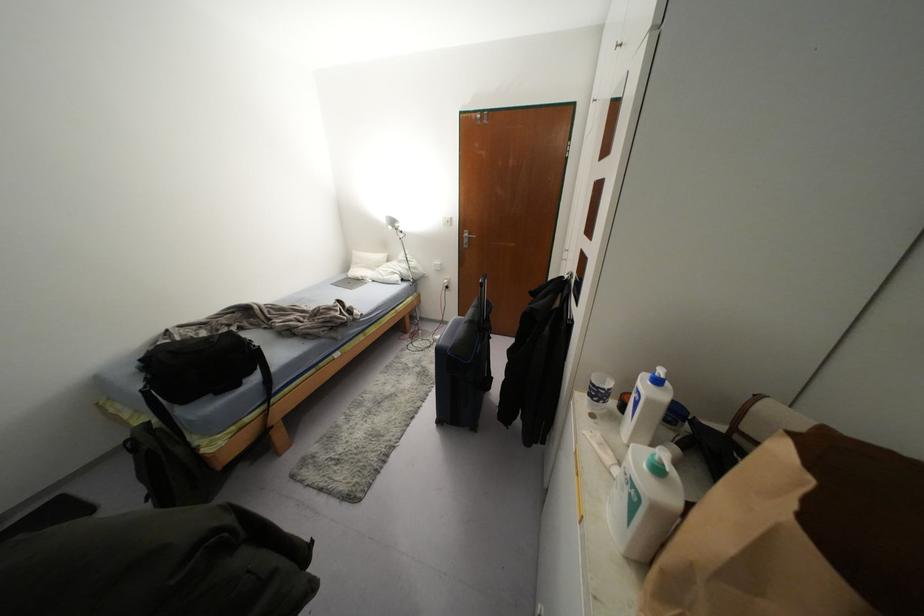
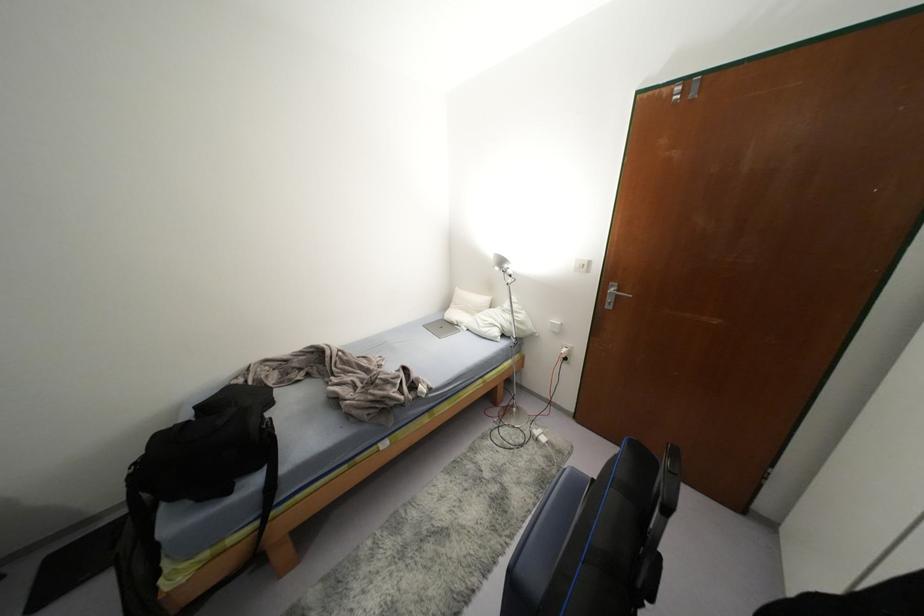
Find the pixel in the second image that matches pixel 382 256 in the first image.

(484, 299)